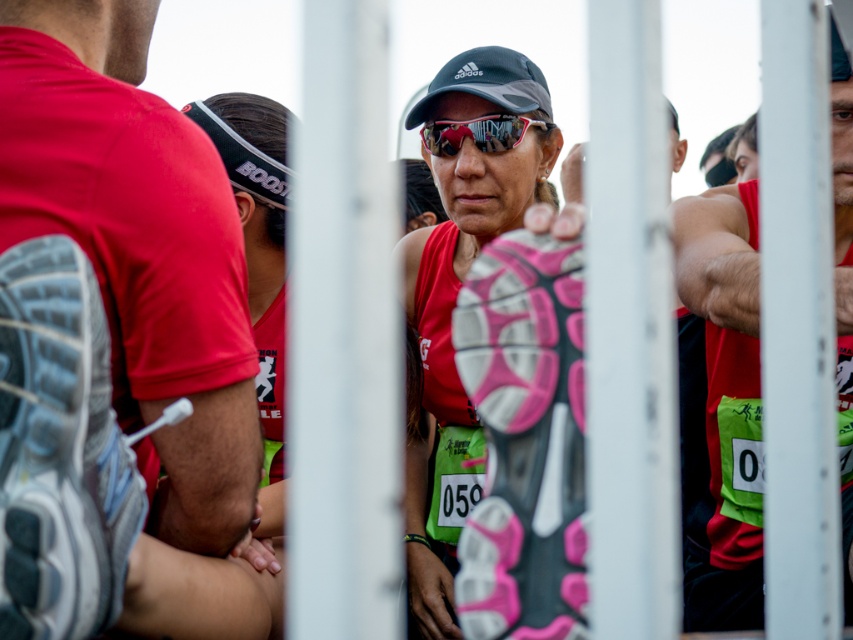
How much distance is there between matte red tank top at center and matte red shirt at left?

matte red tank top at center and matte red shirt at left are 4.50 feet apart from each other.

Between point (463, 465) and point (157, 628), which one is positioned in front?

Point (157, 628) is more forward.

Identify the location of matte red tank top at center. The image size is (853, 640). (462, 280).

At what (x,y) coordinates should I click in order to perform the action: click on matte red tank top at center. Please return your answer as a coordinate pair (x, y). The height and width of the screenshot is (640, 853). Looking at the image, I should click on (462, 280).

From the picture: Is the position of matte red shirt at left less distant than that of shiny red tank top at center?

That is True.

Is matte red shirt at left behind shiny red tank top at center?

No, it is not.

Who is more forward, (244, 452) or (844, 282)?

Positioned in front is point (844, 282).

Locate an element on the screen. matte red shirt at left is located at coordinates (210, 470).

Between matte red shirt at left and matte black goggles at center, which one is positioned higher?

matte black goggles at center is above.

Looking at this image, does matte red shirt at left have a lesser width compared to matte black goggles at center?

Indeed, matte red shirt at left has a lesser width compared to matte black goggles at center.

What do you see at coordinates (210, 470) in the screenshot?
I see `matte red shirt at left` at bounding box center [210, 470].

You are a GUI agent. You are given a task and a screenshot of the screen. Output one action in this format:
    pyautogui.click(x=<x>, y=<y>)
    Task: Click on the matte red shirt at left
    
    Given the screenshot: What is the action you would take?
    pyautogui.click(x=210, y=470)